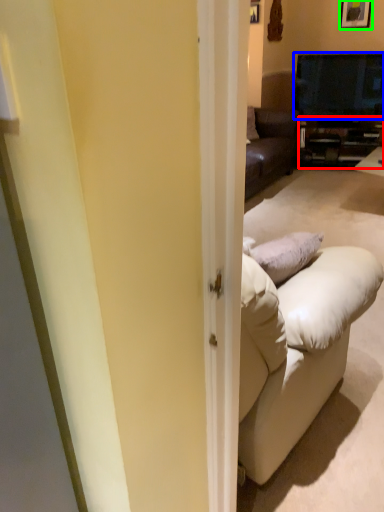
Question: Which object is positioned farthest from cabinetry (highlighted by a red box)? Select from television (highlighted by a blue box) and picture frame (highlighted by a green box).

Choices:
 (A) television
 (B) picture frame

Answer: (B)